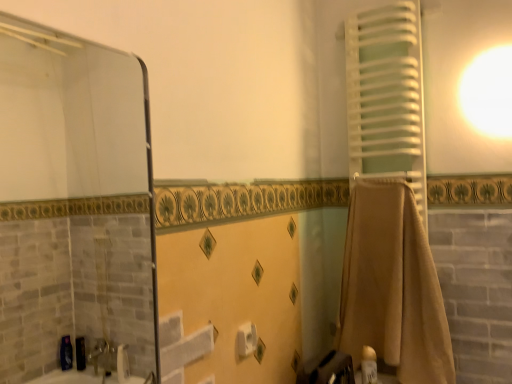
Image resolution: width=512 pixels, height=384 pixels. What do you see at coordinates (392, 286) in the screenshot?
I see `beige cotton towel at right` at bounding box center [392, 286].

From the picture: In order to face white glossy lotion at lower right, should I rotate leftwards or rightwards?

To align with it, rotate right about 15.095°.

Locate an element on the screen. beige cotton towel at right is located at coordinates (392, 286).

Considering the sizes of objects beige cotton towel at right and white glossy lotion at lower right in the image provided, who is shorter, beige cotton towel at right or white glossy lotion at lower right?

white glossy lotion at lower right is shorter.

Where is `toiletry located behind the beige cotton towel at right`? This screenshot has height=384, width=512. toiletry located behind the beige cotton towel at right is located at coordinates click(x=369, y=365).

Looking at this image, is beige cotton towel at right situated inside white glossy lotion at lower right or outside?

beige cotton towel at right exists outside the volume of white glossy lotion at lower right.

From a real-world perspective, which is physically above, beige cotton towel at right or transparent glass mirror at upper left?

transparent glass mirror at upper left, from a real-world perspective.

Is beige cotton towel at right at the left side of transparent glass mirror at upper left?

In fact, beige cotton towel at right is to the right of transparent glass mirror at upper left.

Considering the sizes of objects beige cotton towel at right and transparent glass mirror at upper left in the image provided, who is wider, beige cotton towel at right or transparent glass mirror at upper left?

With larger width is beige cotton towel at right.

Based on the photo, is transparent glass mirror at upper left thinner than white matte toilet paper at center?

In fact, transparent glass mirror at upper left might be wider than white matte toilet paper at center.

Considering the sizes of objects transparent glass mirror at upper left and white matte toilet paper at center in the image provided, who is taller, transparent glass mirror at upper left or white matte toilet paper at center?

With more height is transparent glass mirror at upper left.

Find the location of `toilet paper below the transparent glass mirror at upper left (from the image's perspective)`. toilet paper below the transparent glass mirror at upper left (from the image's perspective) is located at coordinates (247, 339).

From the image's perspective, which object appears higher, transparent glass mirror at upper left or white matte toilet paper at center?

transparent glass mirror at upper left is shown above in the image.

Which object is further away from the camera taking this photo, transparent glass mirror at upper left or white matte towel at right?

Positioned behind is white matte towel at right.

Who is taller, transparent glass mirror at upper left or white matte towel at right?

white matte towel at right.

Considering the positions of objects transparent glass mirror at upper left and white matte towel at right in the image provided, who is more to the left, transparent glass mirror at upper left or white matte towel at right?

transparent glass mirror at upper left is more to the left.

Can you confirm if transparent glass mirror at upper left is thinner than white matte towel at right?

Yes, transparent glass mirror at upper left is thinner than white matte towel at right.

I want to click on toiletry on the right of transparent glass mirror at upper left, so click(369, 365).

In terms of size, does transparent glass mirror at upper left appear bigger or smaller than white glossy lotion at lower right?

Considering their sizes, transparent glass mirror at upper left takes up more space than white glossy lotion at lower right.

Is transparent glass mirror at upper left in front of white glossy lotion at lower right?

Yes, transparent glass mirror at upper left is closer to the camera.

Is transparent glass mirror at upper left to the left of white glossy lotion at lower right from the viewer's perspective?

Correct, you'll find transparent glass mirror at upper left to the left of white glossy lotion at lower right.

Is point (369, 83) behind point (370, 238)?

Yes, point (369, 83) is farther from viewer.

Would you say white matte towel at right is inside or outside beige cotton towel at right?

white matte towel at right lies outside beige cotton towel at right.

Considering the relative positions of white matte towel at right and beige cotton towel at right in the image provided, is white matte towel at right in front of beige cotton towel at right?

No, it is not.

Between point (346, 291) and point (241, 326), which one is positioned behind?

The point (346, 291) is farther.

From a real-world perspective, is beige cotton towel at right on white matte toilet paper at center?

Yes.

Is beige cotton towel at right taller than white matte toilet paper at center?

Yes.

Considering the positions of objects beige cotton towel at right and white matte toilet paper at center in the image provided, who is in front, beige cotton towel at right or white matte toilet paper at center?

white matte toilet paper at center is more forward.

Find the location of a particular element. Image resolution: width=512 pixels, height=384 pixels. toiletry below the beige cotton towel at right (from a real-world perspective) is located at coordinates (369, 365).

This screenshot has height=384, width=512. What are the coordinates of `bath towel below the transparent glass mirror at upper left (from the image's perspective)` in the screenshot? It's located at (392, 286).

Estimate the real-world distances between objects in this image. Which object is closer to beige cotton towel at right, white glossy lotion at lower right or transparent glass mirror at upper left?

white glossy lotion at lower right lies closer to beige cotton towel at right than the other object.

Based on the photo, based on their spatial positions, is beige cotton towel at right or white glossy lotion at lower right closer to white matte toilet paper at center?

white glossy lotion at lower right is closer to white matte toilet paper at center.

Based on their spatial positions, is white matte toilet paper at center or white matte towel at right closer to white glossy lotion at lower right?

white matte toilet paper at center is closer to white glossy lotion at lower right.

From the image, which object appears to be farther from white glossy lotion at lower right, transparent glass mirror at upper left or white matte towel at right?

Based on the image, transparent glass mirror at upper left appears to be further to white glossy lotion at lower right.

Which object lies nearer to the anchor point beige cotton towel at right, transparent glass mirror at upper left or white matte toilet paper at center?

The object closer to beige cotton towel at right is white matte toilet paper at center.

Which object lies nearer to the anchor point white glossy lotion at lower right, white matte toilet paper at center or transparent glass mirror at upper left?

white matte toilet paper at center lies closer to white glossy lotion at lower right than the other object.

Considering their positions, is white matte toilet paper at center positioned closer to beige cotton towel at right than white glossy lotion at lower right?

white glossy lotion at lower right is positioned closer to the anchor beige cotton towel at right.

Based on the photo, based on their spatial positions, is white glossy lotion at lower right or white matte toilet paper at center closer to transparent glass mirror at upper left?

white matte toilet paper at center is closer to transparent glass mirror at upper left.

Locate an element on the screen. The width and height of the screenshot is (512, 384). bath towel between white matte towel at right and white matte toilet paper at center from top to bottom is located at coordinates (392, 286).

Where is `toilet paper positioned between transparent glass mirror at upper left and white matte towel at right from near to far`? toilet paper positioned between transparent glass mirror at upper left and white matte towel at right from near to far is located at coordinates (247, 339).

What are the coordinates of `toilet paper between white matte towel at right and white glossy lotion at lower right in the vertical direction` in the screenshot? It's located at [247, 339].

This screenshot has width=512, height=384. Find the location of `bath towel between transparent glass mirror at upper left and white matte towel at right in the front-back direction`. bath towel between transparent glass mirror at upper left and white matte towel at right in the front-back direction is located at coordinates (392, 286).